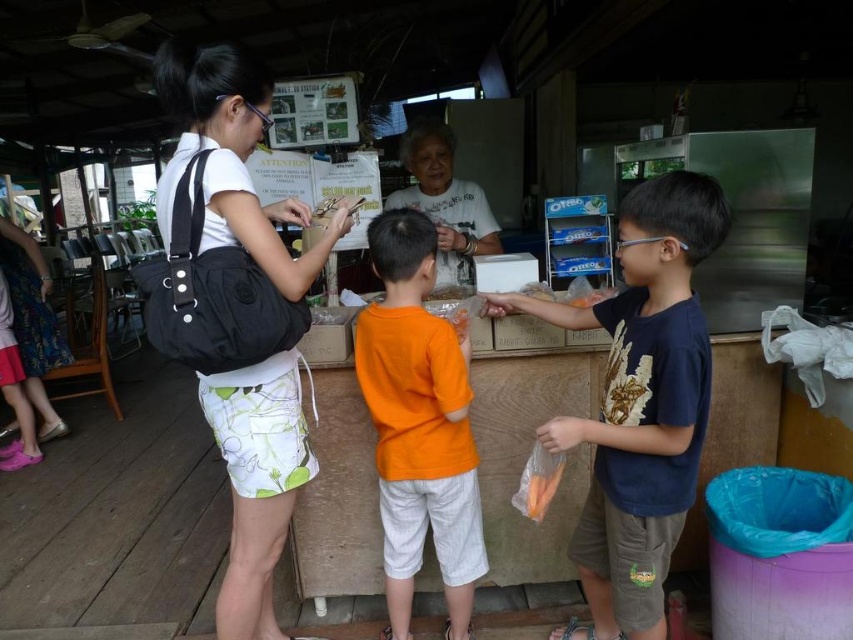
Question: Considering the real-world distances, which object is closest to the white matte shirt at center?

Choices:
 (A) orange matte carrot at center
 (B) orange cotton shirt at center
 (C) black fabric bag at center

Answer: (B)

Question: Which of the following is the farthest from the observer?

Choices:
 (A) orange matte carrot at center
 (B) orange cotton shirt at center
 (C) dark blue t-shirt at center
 (D) black fabric bag at center

Answer: (B)

Question: Is dark blue t-shirt at center below orange cotton shirt at center?

Choices:
 (A) yes
 (B) no

Answer: (B)

Question: Does orange cotton shirt at center appear under orange matte carrot at center?

Choices:
 (A) no
 (B) yes

Answer: (A)

Question: Can you confirm if orange cotton shirt at center is bigger than orange matte carrot at center?

Choices:
 (A) no
 (B) yes

Answer: (B)

Question: Which point is farther to the camera?

Choices:
 (A) orange matte carrot at center
 (B) orange cotton shirt at center
 (C) dark blue t-shirt at center

Answer: (B)